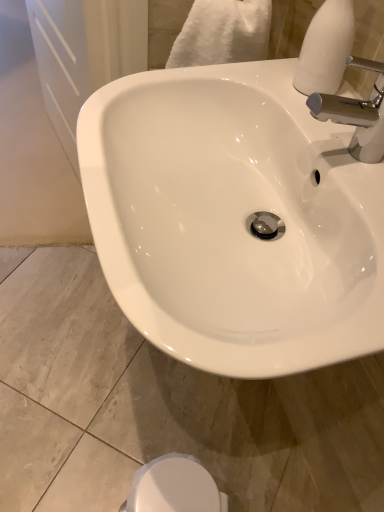
Identify the location of vacant space underneath white glossy sink at center (from a real-world perspective). This screenshot has width=384, height=512. (187, 405).